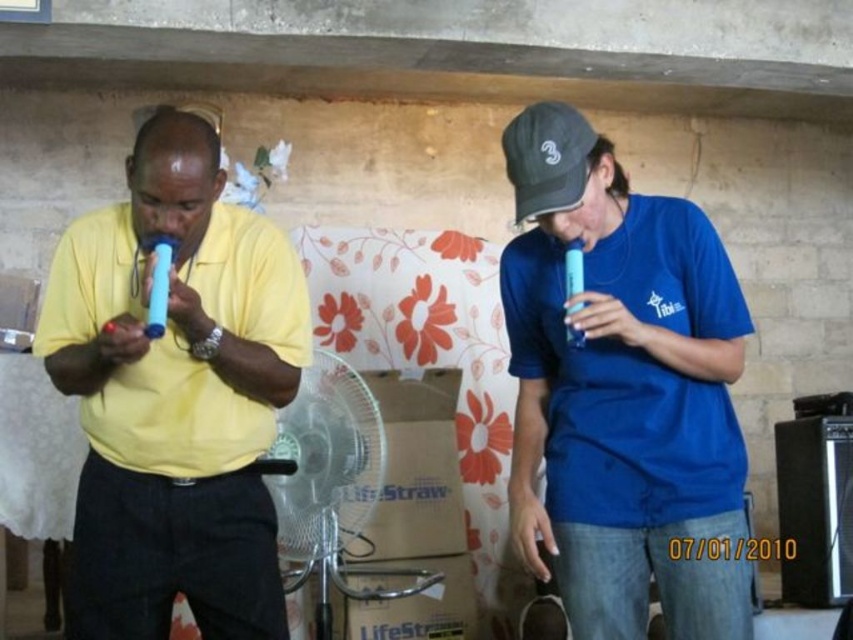
Question: Can you confirm if matte yellow shirt at left is positioned to the left of black fabric baseball cap at upper right?

Choices:
 (A) no
 (B) yes

Answer: (B)

Question: Which object appears closest to the camera in this image?

Choices:
 (A) clear plastic fan at center
 (B) blue matte t-shirt at center

Answer: (B)

Question: Can you confirm if matte yellow shirt at left is positioned to the right of clear plastic fan at center?

Choices:
 (A) no
 (B) yes

Answer: (A)

Question: Which of the following is the farthest from the observer?

Choices:
 (A) (573, 148)
 (B) (114, 296)
 (C) (352, 449)

Answer: (C)

Question: Is clear plastic fan at center above black fabric baseball cap at upper right?

Choices:
 (A) yes
 (B) no

Answer: (B)

Question: Which object is farther from the camera taking this photo?

Choices:
 (A) matte yellow shirt at left
 (B) blue matte t-shirt at center
 (C) black fabric baseball cap at upper right

Answer: (C)